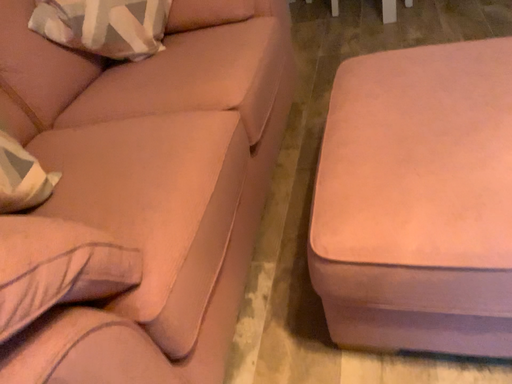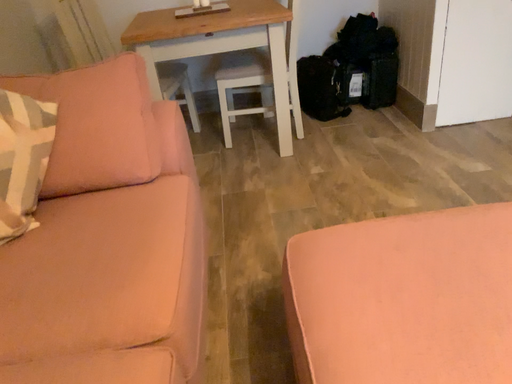
Question: How did the camera likely rotate when shooting the video?

Choices:
 (A) rotated downward
 (B) rotated upward

Answer: (B)